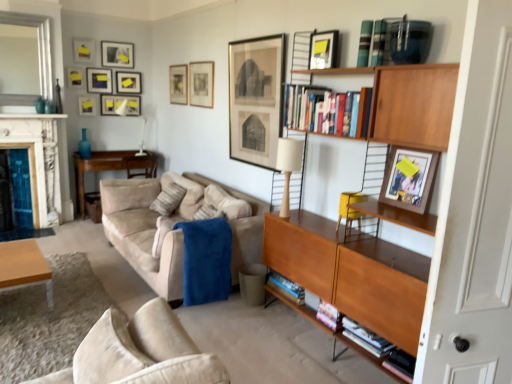
What do you see at coordinates (128, 82) in the screenshot?
I see `matte black picture frame at upper center, the 6th picture frame positioned from the right` at bounding box center [128, 82].

Describe the element at coordinates (84, 50) in the screenshot. This screenshot has width=512, height=384. I see `matte yellow picture frame at upper left, which ranks as the 6th picture frame in front-to-back order` at that location.

Locate an element on the screen. Image resolution: width=512 pixels, height=384 pixels. wooden cabinet at upper right is located at coordinates (353, 274).

Who is shorter, white matte lamp at center or blue plush blanket at center?

With less height is white matte lamp at center.

Is white matte lamp at center at the right side of blue plush blanket at center?

Yes.

Which is less distant, (78, 39) or (139, 87)?

Point (78, 39).

Is matte black picture frame at upper center, which appears as the twelfth picture frame when viewed from the front, at the back of matte yellow picture frame at upper left, arranged as the tenth picture frame when viewed from the right?

No, matte yellow picture frame at upper left, arranged as the tenth picture frame when viewed from the right, is not facing away from matte black picture frame at upper center, which appears as the twelfth picture frame when viewed from the front.

What's the angular difference between matte yellow picture frame at upper left, positioned as the third picture frame in left-to-right order, and matte black picture frame at upper center, the seventh picture frame from the left,'s facing directions?

0.753 degrees separate the facing orientations of matte yellow picture frame at upper left, positioned as the third picture frame in left-to-right order, and matte black picture frame at upper center, the seventh picture frame from the left.

Based on the photo, from the image's perspective, relative to white matte lamp at center, is wooden polished table at left above or below?

Clearly, from the image's perspective, wooden polished table at left is above white matte lamp at center.

Could you tell me if wooden polished table at left is facing white matte lamp at center?

Yes, wooden polished table at left faces towards white matte lamp at center.

This screenshot has width=512, height=384. I want to click on lamp that appears on the right of wooden polished table at left, so click(x=289, y=166).

Considering the points (136, 152) and (283, 200), which point is in front, point (136, 152) or point (283, 200)?

The point (283, 200) is more forward.

Is hardcover books at upper center, which is the 3th book from right to left, placed right next to wooden picture frame at upper right, the 12th picture frame from the back?

hardcover books at upper center, which is the 3th book from right to left, and wooden picture frame at upper right, the 12th picture frame from the back, are clearly separated.

Does point (349, 112) lie behind point (388, 176)?

No, it is in front of (388, 176).

Considering the positions of objects hardcover books at upper center, which is the 3th book from right to left, and wooden picture frame at upper right, the twelfth picture frame viewed from the left, in the image provided, who is in front, hardcover books at upper center, which is the 3th book from right to left, or wooden picture frame at upper right, the twelfth picture frame viewed from the left,?

wooden picture frame at upper right, the twelfth picture frame viewed from the left, is closer to the camera.

Considering the sizes of objects hardcover books at upper center, which is the 3th book from right to left, and wooden picture frame at upper right, the twelfth picture frame viewed from the left, in the image provided, who is bigger, hardcover books at upper center, which is the 3th book from right to left, or wooden picture frame at upper right, the twelfth picture frame viewed from the left,?

hardcover books at upper center, which is the 3th book from right to left.

From the image's perspective, is wooden cabinet at upper right below hardcover books at upper center, acting as the 1th book starting from the left?

Yes, from the image's perspective, wooden cabinet at upper right is beneath hardcover books at upper center, acting as the 1th book starting from the left.

Considering the sizes of wooden cabinet at upper right and hardcover books at upper center, which is the 3th book from right to left, in the image, is wooden cabinet at upper right bigger or smaller than hardcover books at upper center, which is the 3th book from right to left,?

Clearly, wooden cabinet at upper right is larger in size than hardcover books at upper center, which is the 3th book from right to left.

Considering the relative sizes of wooden cabinet at upper right and hardcover books at upper center, acting as the 1th book starting from the left, in the image provided, is wooden cabinet at upper right wider than hardcover books at upper center, acting as the 1th book starting from the left,?

Yes, wooden cabinet at upper right is wider than hardcover books at upper center, acting as the 1th book starting from the left.

Relative to hardcover books at upper center, which is the 3th book from right to left, is wooden cabinet at upper right in front or behind?

wooden cabinet at upper right is positioned closer to the viewer than hardcover books at upper center, which is the 3th book from right to left.

Can you see marble fireplace at left touching yellow fabric armchair at right?

No, marble fireplace at left is not beside yellow fabric armchair at right.

Can we say marble fireplace at left lies outside yellow fabric armchair at right?

That's correct, marble fireplace at left is outside of yellow fabric armchair at right.

Between point (17, 116) and point (359, 193), which one is positioned behind?

Positioned behind is point (17, 116).

From the image's perspective, which one is positioned lower, marble fireplace at left or yellow fabric armchair at right?

yellow fabric armchair at right, from the image's perspective.

Is plaid fabric book at upper center, which is the 3th book in left-to-right order, with hardcover books at upper center, which is the 3th book from right to left?

No, plaid fabric book at upper center, which is the 3th book in left-to-right order, is not in contact with hardcover books at upper center, which is the 3th book from right to left.

Does plaid fabric book at upper center, the 1th book when ordered from right to left, turn towards hardcover books at upper center, which is the 3th book from right to left?

No.

Looking at this image, how distant is plaid fabric book at upper center, the 1th book when ordered from right to left, from hardcover books at upper center, acting as the 1th book starting from the left?

The distance of plaid fabric book at upper center, the 1th book when ordered from right to left, from hardcover books at upper center, acting as the 1th book starting from the left, is 15.48 inches.

Is plaid fabric book at upper center, which is the 3th book in left-to-right order, closer to camera compared to hardcover books at upper center, which is the 3th book from right to left?

Yes.

Identify the location of blanket located behind the white matte lamp at center. (206, 260).

From the matte yellow picture frame at upper left, arranged as the tenth picture frame when viewed from the right, count 4th picture frame to the right and point to it. Please provide its 2D coordinates.

[(128, 82)]

From the image, which object appears to be nearer to wooden cabinet at upper right, blue plush blanket at center or matte black picture frame at upper left, which is the 4th picture frame in back-to-front order?

blue plush blanket at center.

Looking at the image, which one is located closer to matte black picture frame at upper left, which ranks as the fourth picture frame in left-to-right order, plaid fabric book at upper center, which is the 3th book in left-to-right order, or matte black picture frame at upper center, acting as the tenth picture frame starting from the left?

matte black picture frame at upper center, acting as the tenth picture frame starting from the left, is closer to matte black picture frame at upper left, which ranks as the fourth picture frame in left-to-right order.

Looking at the image, which one is located further to matte paper picture frame at upper center, the 9th picture frame viewed from the back, plaid fabric book at upper center, the 1th book when ordered from right to left, or transparent glass door at right?

Based on the image, transparent glass door at right appears to be further to matte paper picture frame at upper center, the 9th picture frame viewed from the back.

From the image, which object appears to be nearer to matte black picture frame at upper left, which ranks as the fourth picture frame in left-to-right order, blue plush blanket at center or matte yellow picture frame at upper left, which ranks as the 6th picture frame in front-to-back order?

The object closer to matte black picture frame at upper left, which ranks as the fourth picture frame in left-to-right order, is matte yellow picture frame at upper left, which ranks as the 6th picture frame in front-to-back order.

From the image, which object appears to be farther from matte black picture frame at upper center, marked as the eighth picture frame in a back-to-front arrangement, matte black picture frame at upper center, the 3th picture frame positioned from the right, or matte black picture frame at upper left, placed as the 5th picture frame when sorted from left to right?

matte black picture frame at upper center, the 3th picture frame positioned from the right, lies further to matte black picture frame at upper center, marked as the eighth picture frame in a back-to-front arrangement, than the other object.

Based on their spatial positions, is suede couch at center or matte black picture frame at upper center, the third picture frame positioned from the back, closer to wooden cabinet at upper right?

suede couch at center is closer to wooden cabinet at upper right.

From the image, which object appears to be nearer to matte black picture frame at upper center, acting as the tenth picture frame starting from the left, matte black picture frame at upper left, which is the 5th picture frame in back-to-front order, or matte black picture frame at upper center, arranged as the 7th picture frame when viewed from the right?

matte black picture frame at upper center, arranged as the 7th picture frame when viewed from the right, is positioned closer to the anchor matte black picture frame at upper center, acting as the tenth picture frame starting from the left.

Estimate the real-world distances between objects in this image. Which object is closer to matte black picture frame at upper center, arranged as the 7th picture frame when viewed from the right, suede couch at center or blue plush blanket at center?

suede couch at center.

Find the location of a particular element. The height and width of the screenshot is (384, 512). lamp between wooden picture frame at upper right, the twelfth picture frame viewed from the left, and matte paper picture frame at upper center, marked as the fourth picture frame in a front-to-back arrangement, in the front-back direction is located at coordinates (289, 166).

Identify the location of table between matte black picture frame at upper center, arranged as the eleventh picture frame when viewed from the left, and matte black picture frame at upper left, which ranks as the 9th picture frame in right-to-left order, in the front-back direction. The width and height of the screenshot is (512, 384). (110, 169).

Identify the location of studio couch located between transparent glass door at right and matte paper picture frame at upper center, the fourth picture frame in the right-to-left sequence, in the depth direction. (170, 229).

This screenshot has width=512, height=384. I want to click on studio couch between blue hardcover book at upper right, which ranks as the 2th book in left-to-right order, and matte black picture frame at upper center, marked as the eighth picture frame in a back-to-front arrangement, in the front-back direction, so click(x=170, y=229).